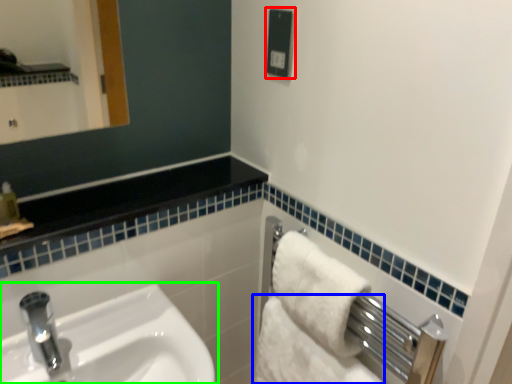
Question: Which object is positioned closest to electric outlet (highlighted by a red box)? Select from bath towel (highlighted by a blue box) and sink (highlighted by a green box).

Choices:
 (A) bath towel
 (B) sink

Answer: (A)